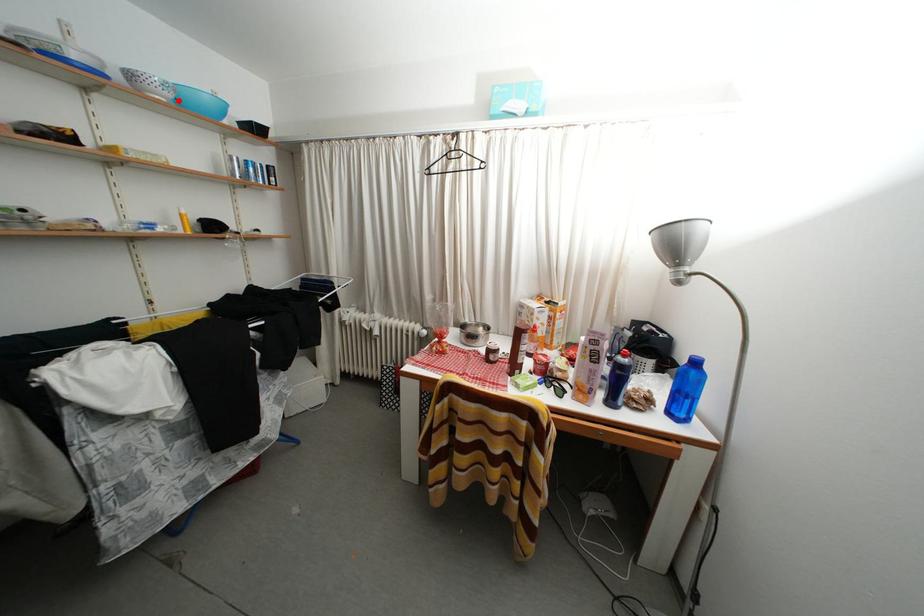
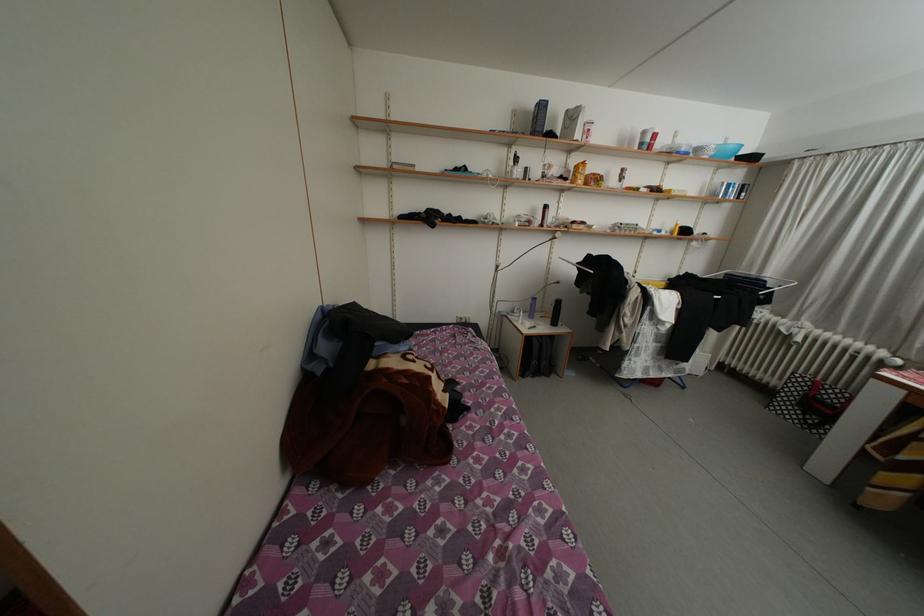
Locate, in the second image, the point that corresponds to the highlighted location in the first image.

(721, 159)